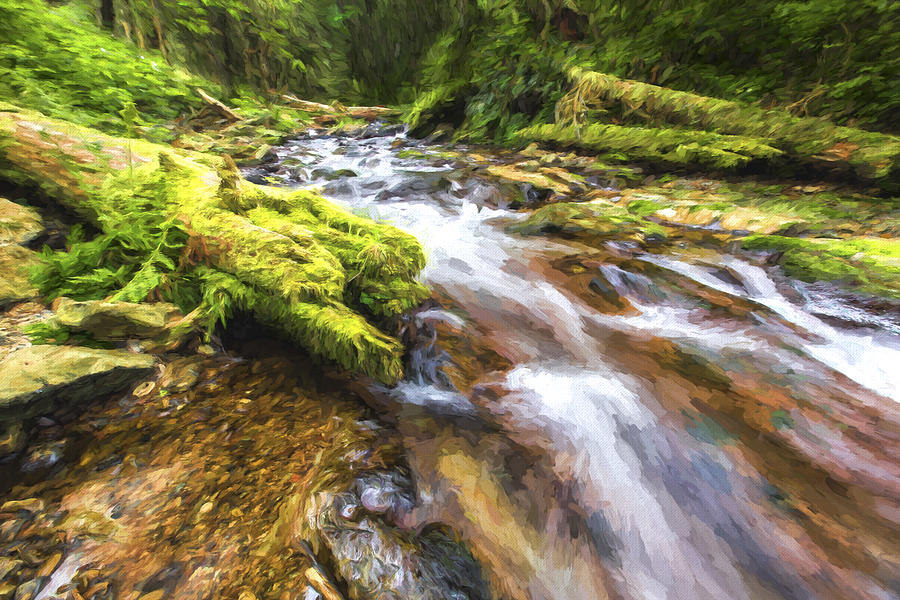
This screenshot has height=600, width=900. Find the location of `painting`. painting is located at coordinates (353, 192).